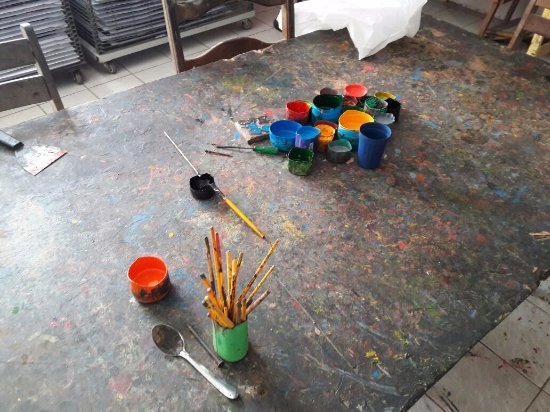
Find the location of a particular element. The height and width of the screenshot is (412, 550). floor is located at coordinates (491, 393).